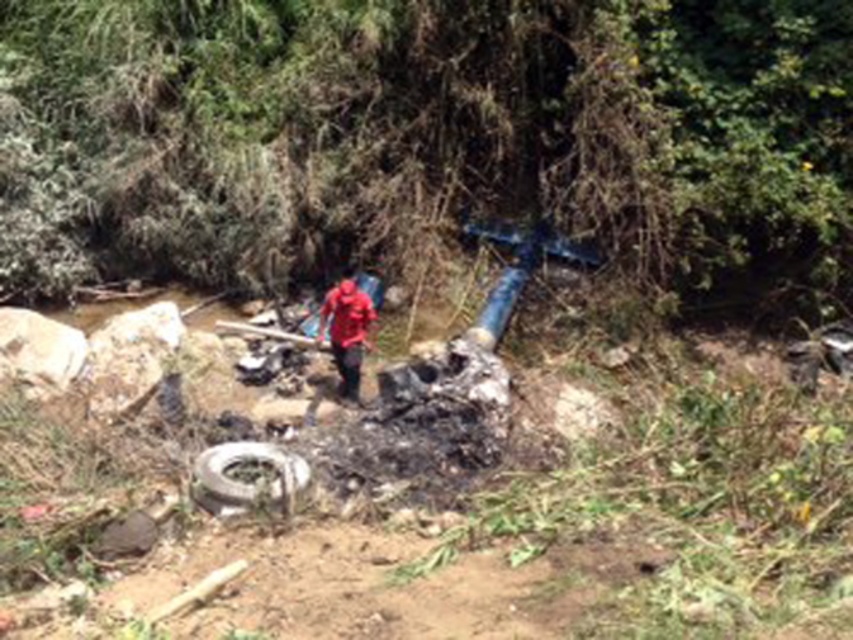
Question: From the image, what is the correct spatial relationship of white rubber tire at lower center in relation to red matte jacket at center?

Choices:
 (A) right
 (B) left

Answer: (B)

Question: Does white rubber tire at lower center appear on the right side of red matte jacket at center?

Choices:
 (A) no
 (B) yes

Answer: (A)

Question: Which of the following is the closest to the observer?

Choices:
 (A) white rubber tire at lower center
 (B) red matte jacket at center

Answer: (A)

Question: Is white rubber tire at lower center wider than red matte jacket at center?

Choices:
 (A) yes
 (B) no

Answer: (A)

Question: Which object appears closest to the camera in this image?

Choices:
 (A) red matte jacket at center
 (B) white rubber tire at lower center

Answer: (B)